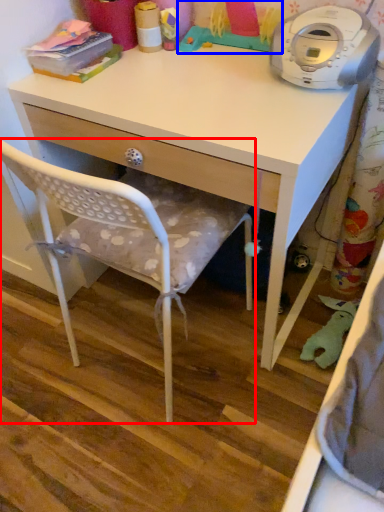
Question: Which object appears farthest to the camera in this image, chair (highlighted by a red box) or toy (highlighted by a blue box)?

Choices:
 (A) chair
 (B) toy

Answer: (B)